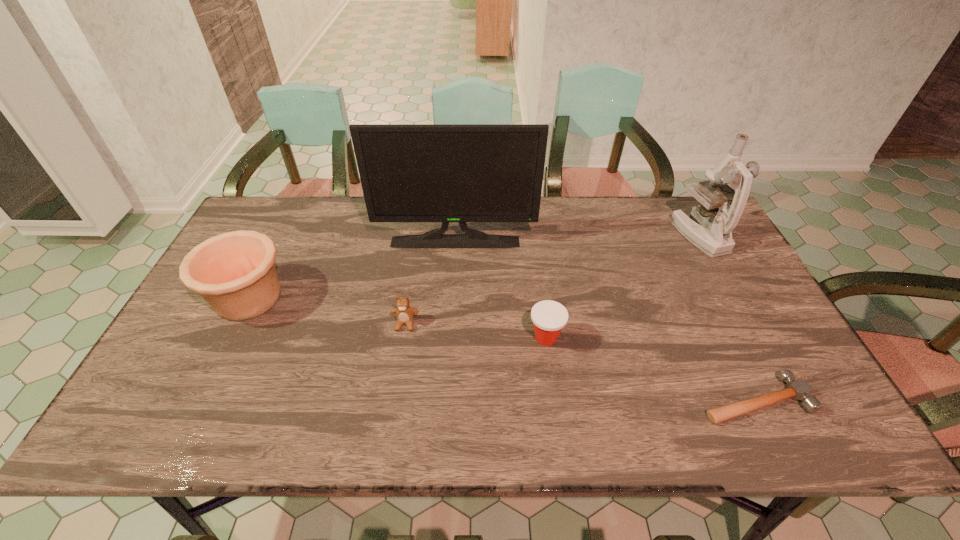
Find the location of `object present at the far right corner`. object present at the far right corner is located at coordinates (712, 233).

The image size is (960, 540). Find the location of `object located in the near right corner section of the desktop`. object located in the near right corner section of the desktop is located at coordinates pyautogui.click(x=797, y=389).

Image resolution: width=960 pixels, height=540 pixels. Find the location of `blank area at the far edge`. blank area at the far edge is located at coordinates (321, 219).

Find the location of a particular element. This screenshot has height=540, width=960. vacant space at the near edge of the desktop is located at coordinates (408, 431).

In order to click on vacant space at the left edge of the desktop in this screenshot , I will do `click(207, 321)`.

This screenshot has width=960, height=540. In the image, there is a desktop. What are the coordinates of `vacant space at the right edge` in the screenshot? It's located at (711, 278).

Where is `vacant position at the far left corner of the desktop`? vacant position at the far left corner of the desktop is located at coordinates (270, 197).

Locate an element on the screen. The image size is (960, 540). vacant space at the far right corner of the desktop is located at coordinates (672, 203).

In order to click on vacant region between the microscope and the monitor in this screenshot , I will do click(x=577, y=239).

Locate an element on the screen. This screenshot has width=960, height=540. vacant space that's between the Dixie cup and the microscope is located at coordinates (622, 286).